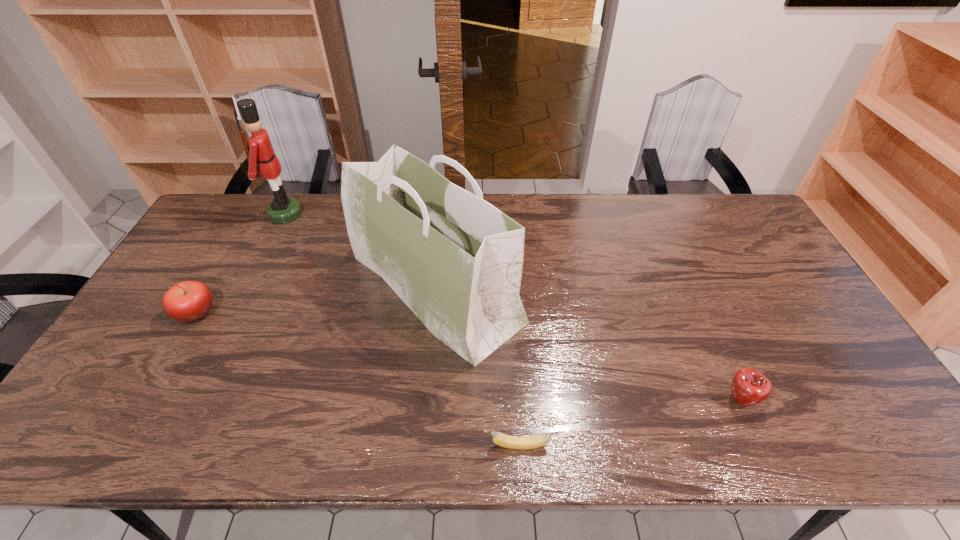
Find the location of a particular element. Image resolution: width=960 pixels, height=540 pixels. the farthest object is located at coordinates (259, 149).

This screenshot has width=960, height=540. Find the location of `grocery bag`. grocery bag is located at coordinates (456, 261).

Identify the location of the left apple. (187, 301).

Identify the location of the right apple. This screenshot has height=540, width=960. (749, 387).

Where is `the fourth farthest object`? Image resolution: width=960 pixels, height=540 pixels. the fourth farthest object is located at coordinates (749, 387).

At what (x,y) coordinates should I click in order to perform the action: click on banana. Please return your answer as a coordinate pair (x, y). Looking at the image, I should click on (507, 441).

The width and height of the screenshot is (960, 540). I want to click on the nearest object, so click(x=507, y=441).

Image resolution: width=960 pixels, height=540 pixels. What are the coordinates of `free spot located 0.190m on the front-facing side of the nutcracker` in the screenshot? It's located at (355, 214).

The height and width of the screenshot is (540, 960). I want to click on vacant space positioned 0.250m on the left of the grocery bag, so click(x=265, y=287).

You are a GUI agent. You are given a task and a screenshot of the screen. Output one action in this format:
    pyautogui.click(x=<x>, y=<y>)
    Task: Click on the blank space located 0.180m on the back of the left apple
    The image size is (960, 540).
    Given the screenshot: What is the action you would take?
    pyautogui.click(x=229, y=255)